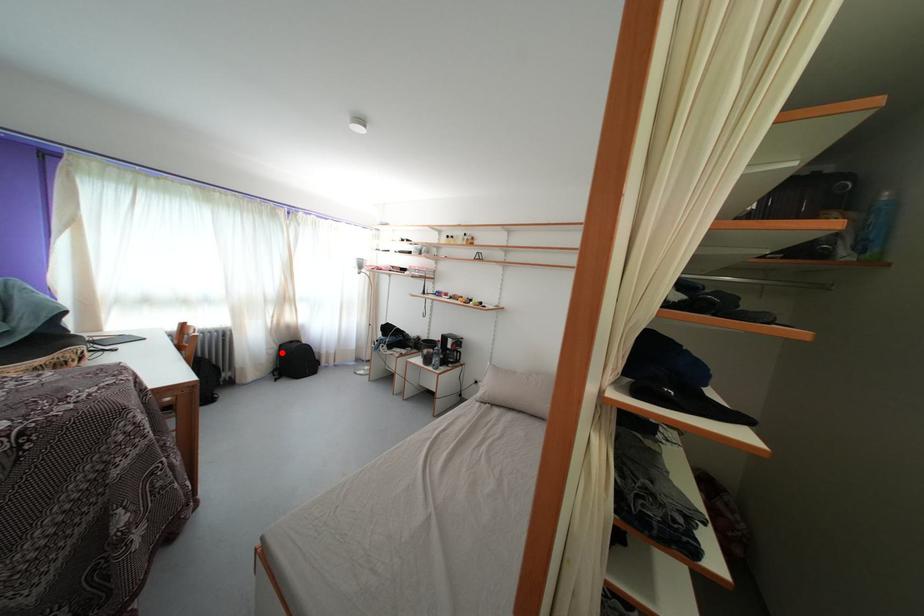
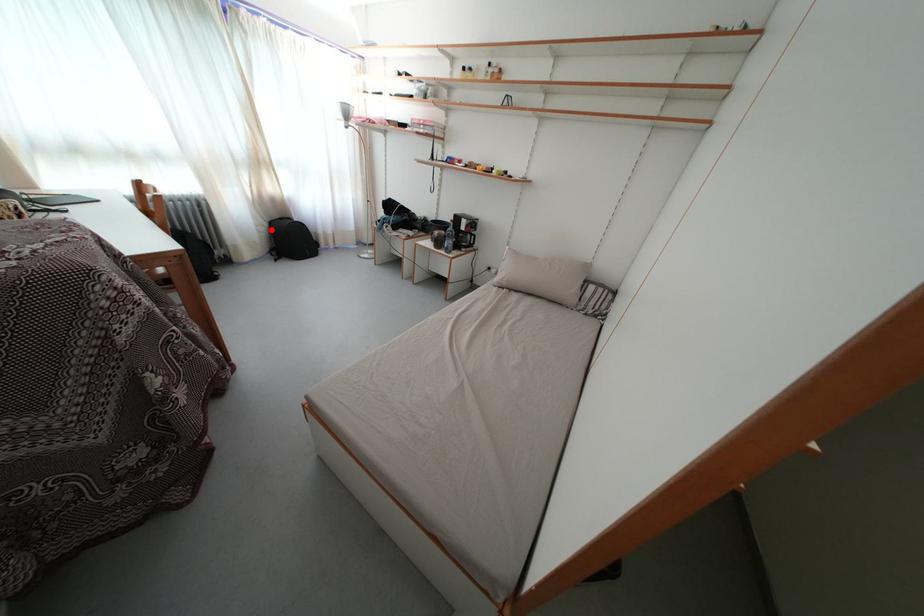
I am providing you with two images of the same scene from different viewpoints. A red point is marked on the first image and another point is marked on the second image. Is the red point in image1 aligned with the point shown in image2?

Yes